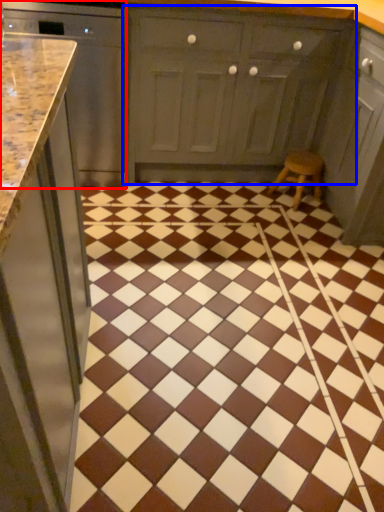
Question: Which object appears farthest to the camera in this image, cabinetry (highlighted by a red box) or cabinetry (highlighted by a blue box)?

Choices:
 (A) cabinetry
 (B) cabinetry

Answer: (B)